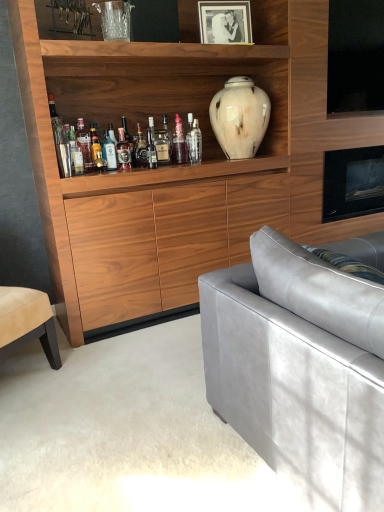
Question: Is black matte photo frame at upper center oriented towards translucent glass bottle at center, placed as the 3th bottle when sorted from right to left?

Choices:
 (A) yes
 (B) no

Answer: (B)

Question: Is the position of black matte photo frame at upper center more distant than that of translucent glass bottle at center, placed as the 7th bottle when sorted from left to right?

Choices:
 (A) yes
 (B) no

Answer: (B)

Question: Is black matte photo frame at upper center oriented away from translucent glass bottle at center, placed as the 3th bottle when sorted from right to left?

Choices:
 (A) no
 (B) yes

Answer: (A)

Question: From the image's perspective, does black matte photo frame at upper center appear higher than translucent glass bottle at center, placed as the 3th bottle when sorted from right to left?

Choices:
 (A) yes
 (B) no

Answer: (A)

Question: From the image's perspective, is black matte photo frame at upper center below translucent glass bottle at center, placed as the 7th bottle when sorted from left to right?

Choices:
 (A) no
 (B) yes

Answer: (A)

Question: From the image's perspective, relative to black matte photo frame at upper center, is translucent glass bottle at center, placed as the 7th bottle when sorted from left to right, above or below?

Choices:
 (A) above
 (B) below

Answer: (B)

Question: Is translucent glass bottle at center, placed as the 7th bottle when sorted from left to right, bigger or smaller than black matte photo frame at upper center?

Choices:
 (A) small
 (B) big

Answer: (A)

Question: Is translucent glass bottle at center, placed as the 7th bottle when sorted from left to right, taller or shorter than black matte photo frame at upper center?

Choices:
 (A) short
 (B) tall

Answer: (A)

Question: Is translucent glass bottle at center, placed as the 7th bottle when sorted from left to right, wider or thinner than black matte photo frame at upper center?

Choices:
 (A) thin
 (B) wide

Answer: (A)

Question: Does point (256, 449) appear closer or farther from the camera than point (160, 156)?

Choices:
 (A) farther
 (B) closer

Answer: (B)

Question: Is suede gray couch at right to the left or to the right of translucent glass bottle at center in the image?

Choices:
 (A) left
 (B) right

Answer: (B)

Question: In terms of width, does suede gray couch at right look wider or thinner when compared to translucent glass bottle at center?

Choices:
 (A) thin
 (B) wide

Answer: (B)

Question: From the image's perspective, relative to translucent glass bottle at center, is suede gray couch at right above or below?

Choices:
 (A) below
 (B) above

Answer: (A)

Question: Considering the positions of translucent glass bottle at shelf center, acting as the eighth bottle starting from the right, and translucent glass bottle at shelf center, the 2th bottle in the right-to-left sequence, in the image, is translucent glass bottle at shelf center, acting as the eighth bottle starting from the right, bigger or smaller than translucent glass bottle at shelf center, the 2th bottle in the right-to-left sequence,?

Choices:
 (A) small
 (B) big

Answer: (B)

Question: Is translucent glass bottle at shelf center, which is the second bottle from left to right, in front of or behind translucent glass bottle at shelf center, positioned as the eighth bottle in left-to-right order, in the image?

Choices:
 (A) front
 (B) behind

Answer: (A)